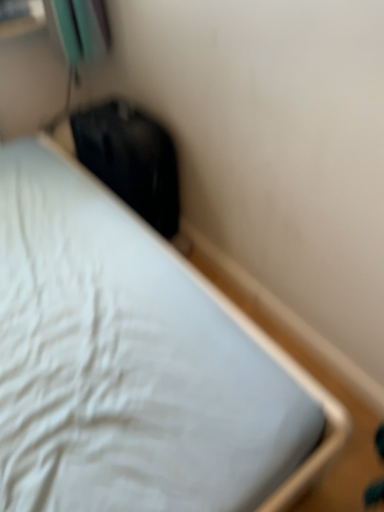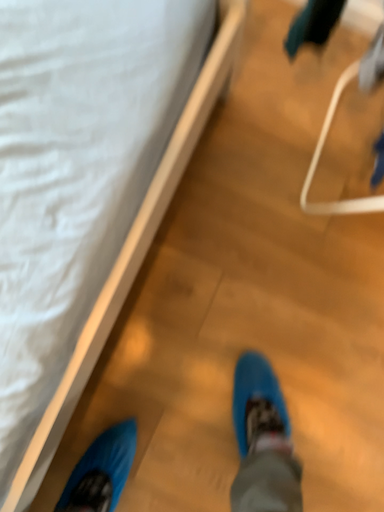
Question: Which way did the camera rotate in the video?

Choices:
 (A) rotated downward
 (B) rotated upward

Answer: (A)